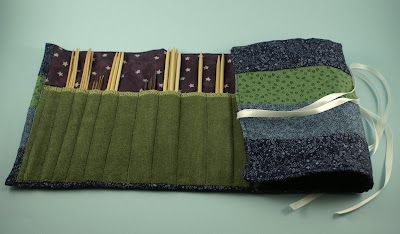
Find the location of a particular element. The width and height of the screenshot is (400, 234). fabric holder is located at coordinates click(x=276, y=131).